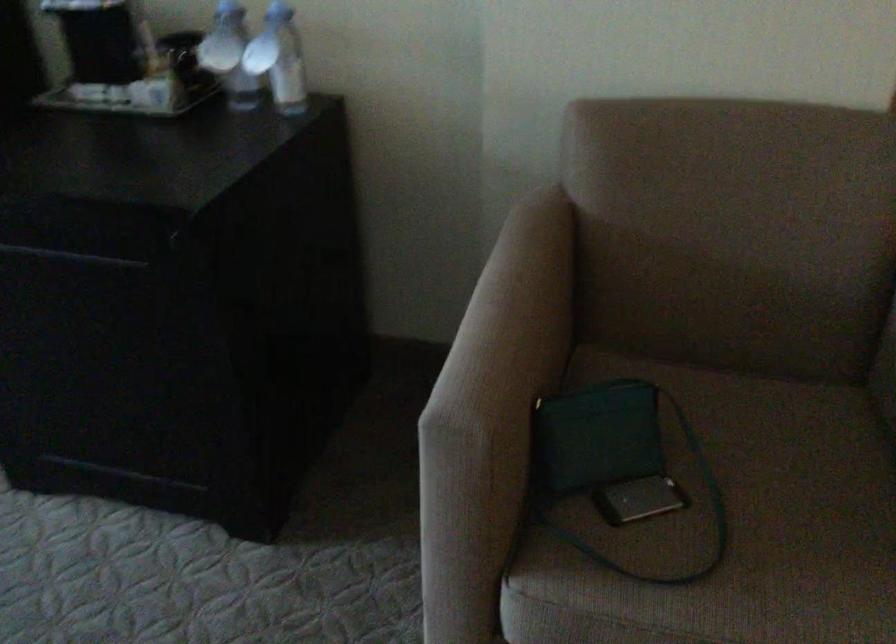
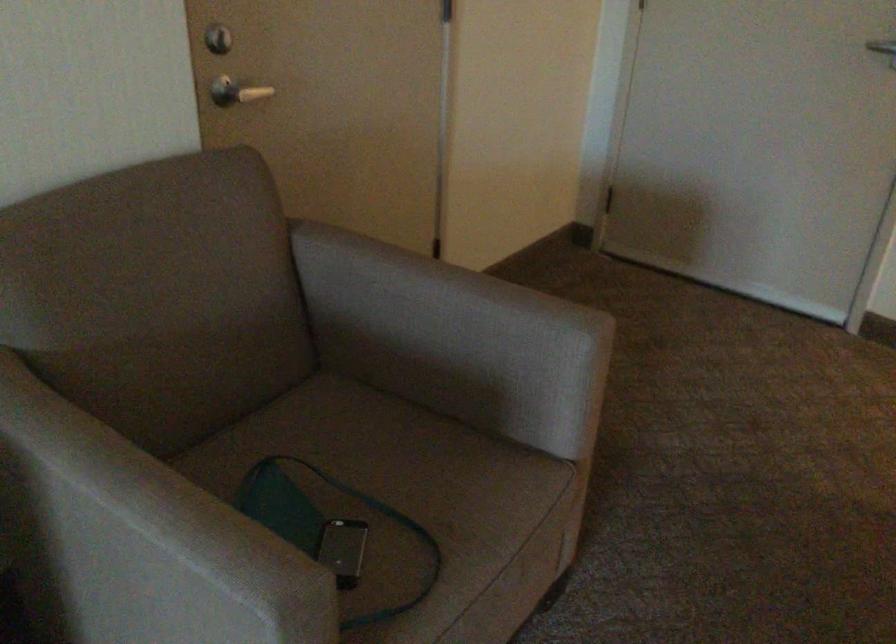
Find the pixel in the second image that matches the point at 648,465 in the first image.

(322, 526)